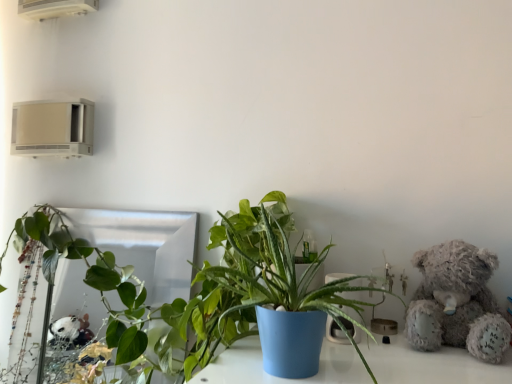
Question: Is white plastic air conditioner at upper left, which ranks as the 1th air conditioning in top-to-bottom order, to the left of fluffy gray teddy bear at right from the viewer's perspective?

Choices:
 (A) no
 (B) yes

Answer: (B)

Question: Does white plastic air conditioner at upper left, which ranks as the 1th air conditioning in top-to-bottom order, have a larger size compared to fluffy gray teddy bear at right?

Choices:
 (A) no
 (B) yes

Answer: (A)

Question: Is white plastic air conditioner at upper left, marked as the 2th air conditioning in a bottom-to-top arrangement, placed right next to fluffy gray teddy bear at right?

Choices:
 (A) yes
 (B) no

Answer: (B)

Question: Can you confirm if white plastic air conditioner at upper left, marked as the 2th air conditioning in a bottom-to-top arrangement, is shorter than fluffy gray teddy bear at right?

Choices:
 (A) no
 (B) yes

Answer: (B)

Question: Could you tell me if white plastic air conditioner at upper left, which ranks as the 1th air conditioning in top-to-bottom order, is turned towards fluffy gray teddy bear at right?

Choices:
 (A) yes
 (B) no

Answer: (B)

Question: In terms of height, does beige plastic air conditioner at upper left, which is the 1th air conditioning in bottom-to-top order, look taller or shorter compared to green leafy plant at center, placed as the second houseplant when sorted from left to right?

Choices:
 (A) tall
 (B) short

Answer: (B)

Question: Is beige plastic air conditioner at upper left, which is the 1th air conditioning in bottom-to-top order, in front of or behind green leafy plant at center, acting as the 2th houseplant starting from the back, in the image?

Choices:
 (A) front
 (B) behind

Answer: (B)

Question: From the image's perspective, relative to green leafy plant at center, which is counted as the first houseplant, starting from the right, is beige plastic air conditioner at upper left, the second air conditioning viewed from the top, above or below?

Choices:
 (A) below
 (B) above

Answer: (B)

Question: Considering the positions of point coord(17,110) and point coord(263,249), is point coord(17,110) closer or farther from the camera than point coord(263,249)?

Choices:
 (A) farther
 (B) closer

Answer: (A)

Question: Looking at their shapes, would you say white plastic air conditioner at upper left, marked as the 2th air conditioning in a bottom-to-top arrangement, is wider or thinner than green leafy plant at center, acting as the 2th houseplant starting from the back?

Choices:
 (A) thin
 (B) wide

Answer: (A)

Question: Considering their positions, is white plastic air conditioner at upper left, marked as the 2th air conditioning in a bottom-to-top arrangement, located in front of or behind green leafy plant at center, the 1th houseplant positioned from the front?

Choices:
 (A) behind
 (B) front

Answer: (A)

Question: Is white plastic air conditioner at upper left, marked as the 2th air conditioning in a bottom-to-top arrangement, spatially inside green leafy plant at center, placed as the second houseplant when sorted from left to right, or outside of it?

Choices:
 (A) outside
 (B) inside

Answer: (A)

Question: From the image's perspective, is white plastic air conditioner at upper left, marked as the 2th air conditioning in a bottom-to-top arrangement, located above or below green leafy plant at center, the 1th houseplant positioned from the front?

Choices:
 (A) below
 (B) above

Answer: (B)

Question: Visually, is white plastic air conditioner at upper left, marked as the 2th air conditioning in a bottom-to-top arrangement, positioned to the left or to the right of beige plastic air conditioner at upper left, the second air conditioning viewed from the top?

Choices:
 (A) right
 (B) left

Answer: (A)

Question: Considering the positions of white plastic air conditioner at upper left, which ranks as the 1th air conditioning in top-to-bottom order, and beige plastic air conditioner at upper left, which is the 1th air conditioning in bottom-to-top order, in the image, is white plastic air conditioner at upper left, which ranks as the 1th air conditioning in top-to-bottom order, bigger or smaller than beige plastic air conditioner at upper left, which is the 1th air conditioning in bottom-to-top order,?

Choices:
 (A) big
 (B) small

Answer: (B)